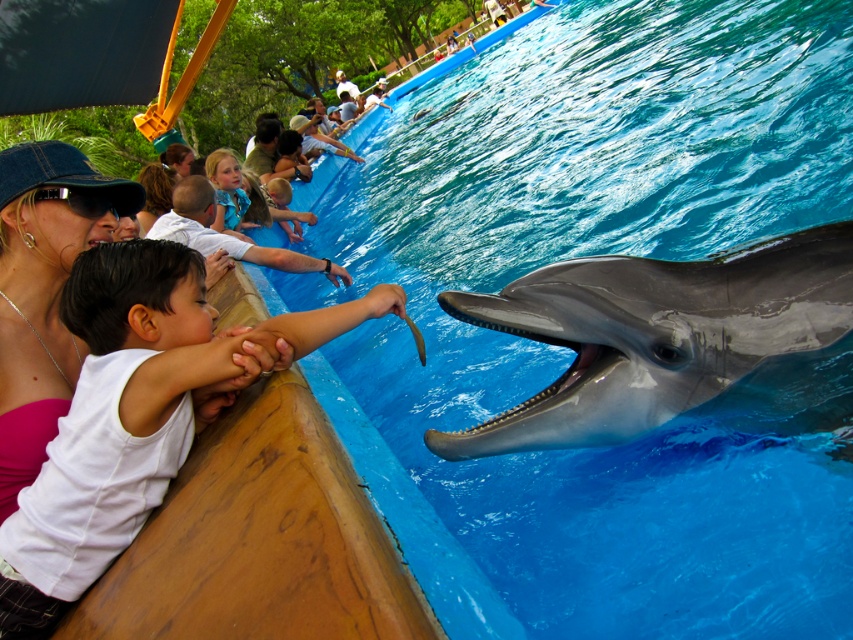
You are a photographer trying to capture a photo of the dolphin show. You have two guests in your frame, a person wearing a white matte shirt at left and another in a blue satin dress at upper center. Which guest is closer to the dolphin on the right side of the frame?

The white matte shirt at left is positioned under the blue satin dress at upper center, meaning the blue satin dress at upper center is closer to the dolphin on the right side of the frame.